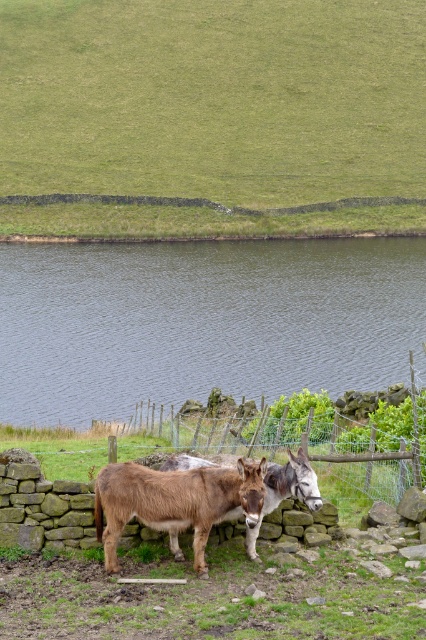
You are a hiker who wants to cross the dark blue water at center. There is a green grass at upper center nearby. Which area is bigger in size between the two?

The green grass at upper center is larger in size than the dark blue water at center, so the green grass area is bigger.